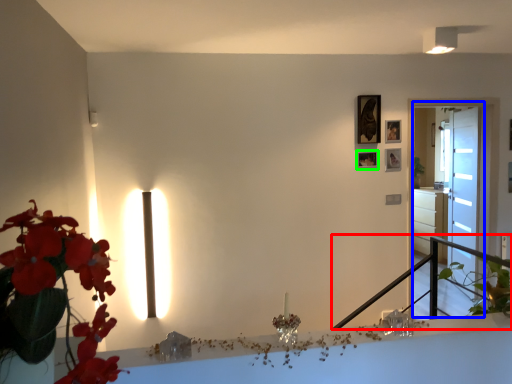
Question: Which object is positioned farthest from balustrade (highlighted by a red box)? Select from glass door (highlighted by a blue box) and picture frame (highlighted by a green box).

Choices:
 (A) glass door
 (B) picture frame

Answer: (B)